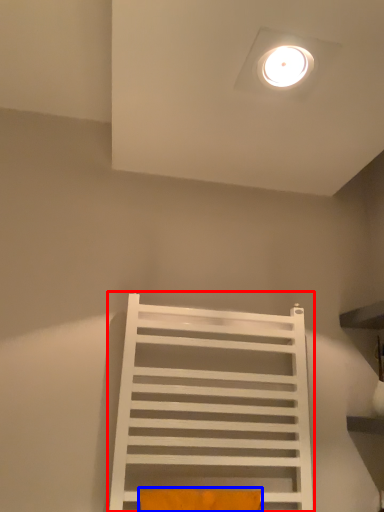
Question: Which point is closer to the camera, furniture (highlighted by a red box) or pillow (highlighted by a blue box)?

Choices:
 (A) furniture
 (B) pillow

Answer: (B)